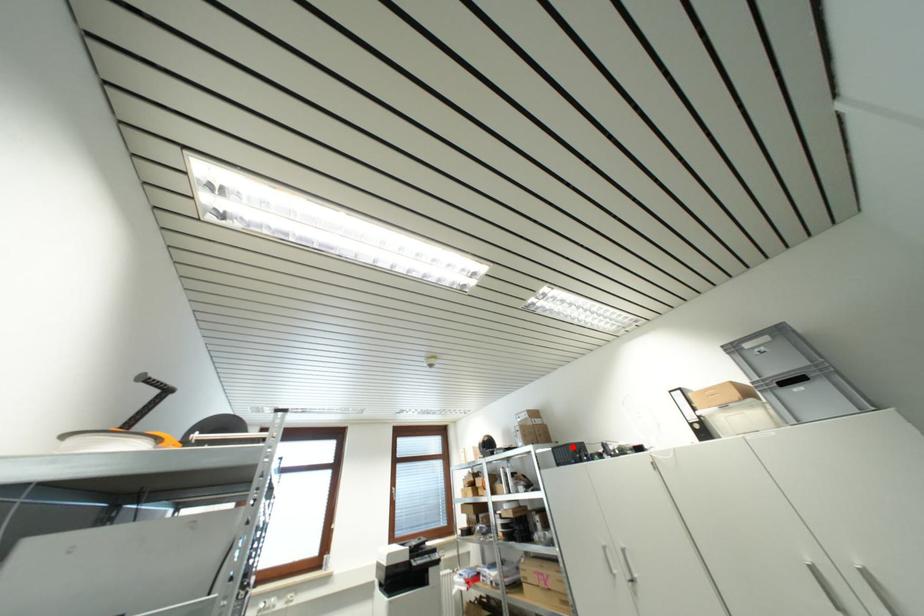
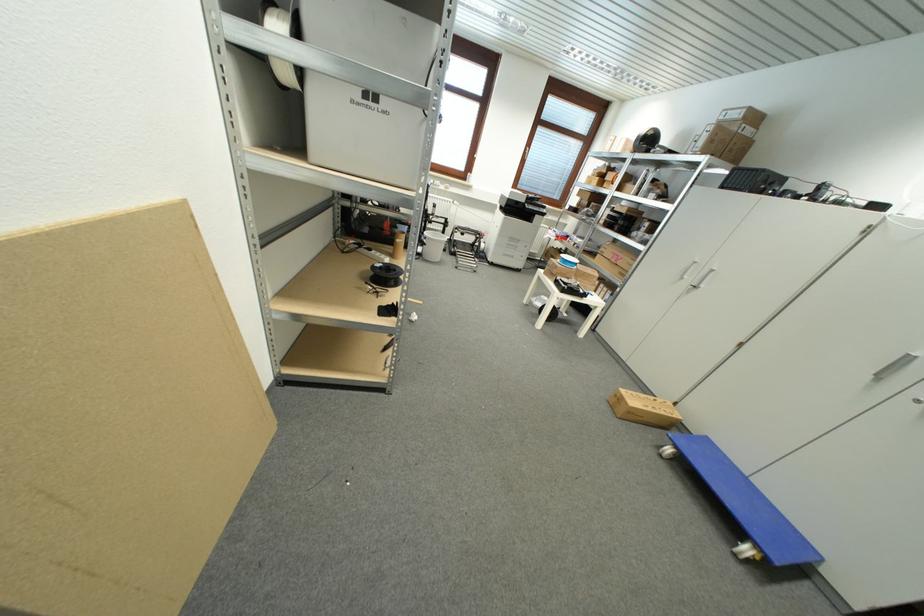
Question: I am providing you with two images of the same scene from different viewpoints. A red point is shown in image1. For the corresponding object point in image2, is it positioned nearer or farther from the camera?

Choices:
 (A) Nearer
 (B) Farther

Answer: (A)